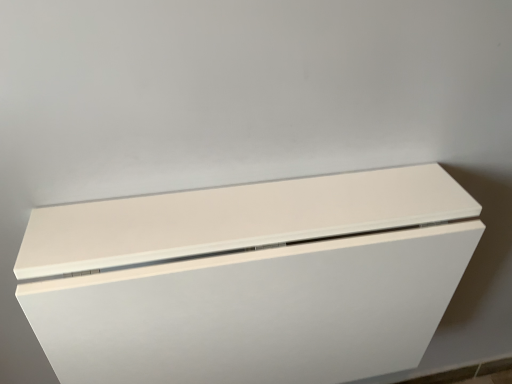
Find the location of `white matte cabinet at center`. white matte cabinet at center is located at coordinates (250, 279).

What do you see at coordinates (250, 279) in the screenshot? I see `white matte cabinet at center` at bounding box center [250, 279].

Identify the location of white matte cabinet at center. (250, 279).